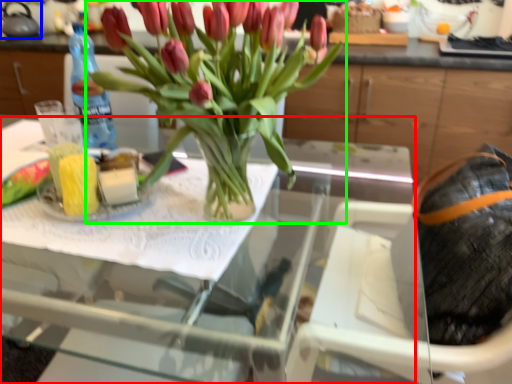
Question: Based on their relative distances, which object is farther from table (highlighted by a red box)? Choose from kettle (highlighted by a blue box) and houseplant (highlighted by a green box).

Choices:
 (A) kettle
 (B) houseplant

Answer: (A)